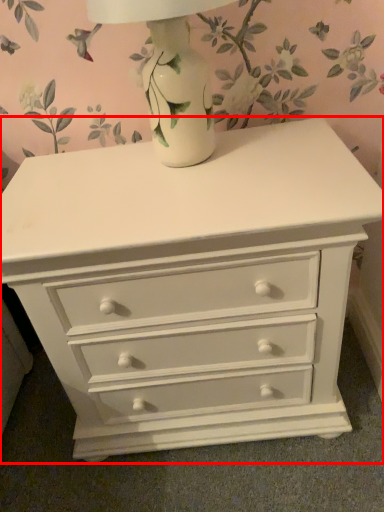
Question: Where is chest of drawers (annotated by the red box) located in relation to table lamp in the image?

Choices:
 (A) left
 (B) right

Answer: (B)